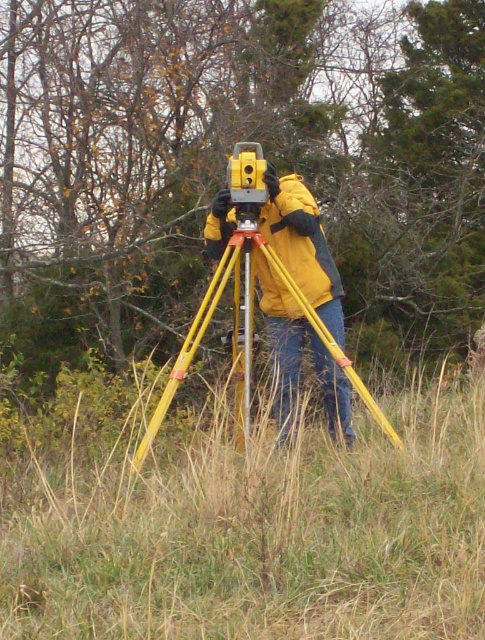
Is yellow matte tripod at center to the right of yellow plastic tripod at center from the viewer's perspective?

Correct, you'll find yellow matte tripod at center to the right of yellow plastic tripod at center.

Measure the distance from yellow matte tripod at center to yellow plastic tripod at center.

They are 20.59 centimeters apart.

You are a GUI agent. You are given a task and a screenshot of the screen. Output one action in this format:
    pyautogui.click(x=<x>, y=<y>)
    Task: Click on the yellow matte tripod at center
    
    Given the screenshot: What is the action you would take?
    pyautogui.click(x=297, y=355)

At what (x,y) coordinates should I click in order to perform the action: click on yellow matte tripod at center. Please return your answer as a coordinate pair (x, y). The image size is (485, 640). Looking at the image, I should click on (297, 355).

Does green leafy tree at center have a smaller size compared to matte yellow jacket at center?

Yes.

Who is lower down, green leafy tree at center or matte yellow jacket at center?

matte yellow jacket at center is below.

Is point (63, 148) less distant than point (269, 298)?

No, (63, 148) is behind (269, 298).

Locate an element on the screen. green leafy tree at center is located at coordinates (226, 156).

Between yellow matte tripod at center and matte yellow jacket at center, which one appears on the left side from the viewer's perspective?

matte yellow jacket at center is more to the left.

Between point (333, 294) and point (267, 216), which one is positioned in front?

Point (333, 294)

Locate an element on the screen. This screenshot has height=640, width=485. yellow matte tripod at center is located at coordinates (297, 355).